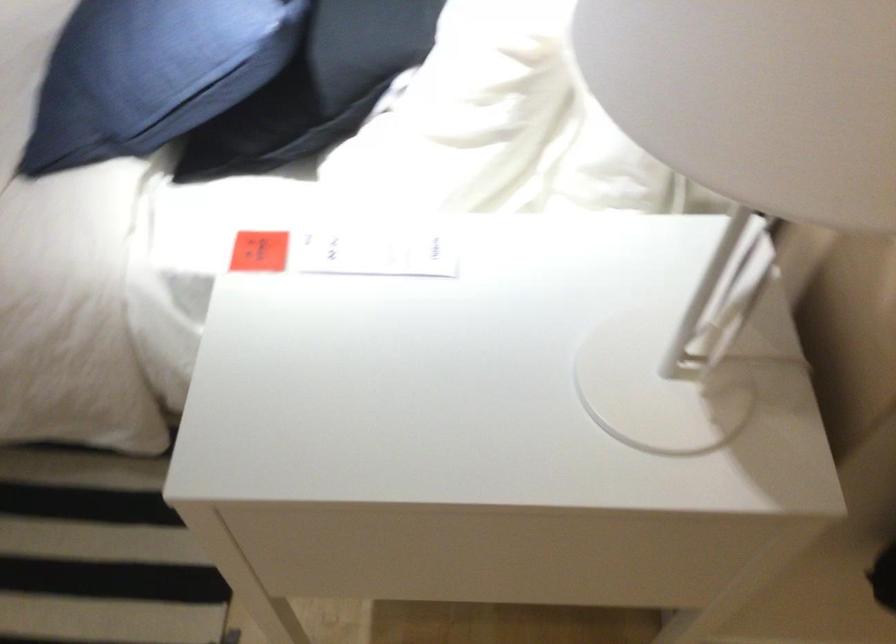
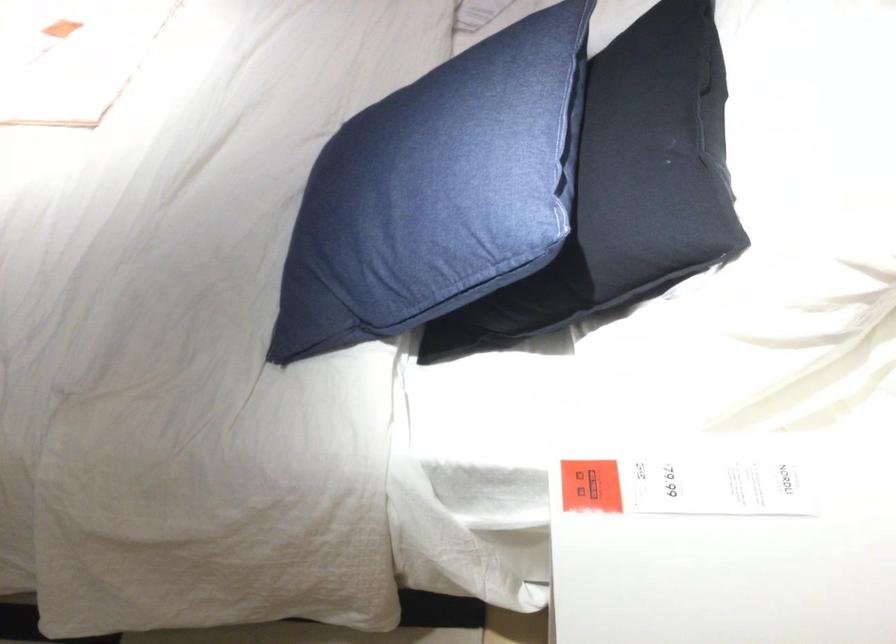
Question: The images are taken continuously from a first-person perspective. In which direction is your viewpoint rotating?

Choices:
 (A) Left
 (B) Right
 (C) Up
 (D) Down

Answer: (A)